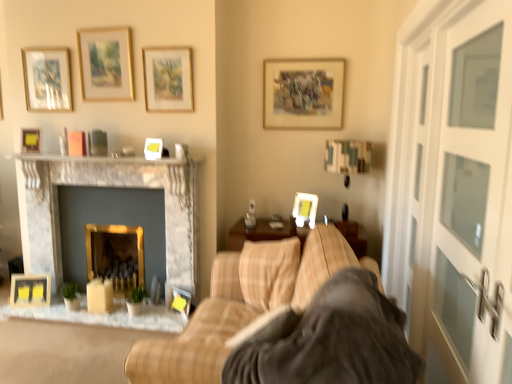
I want to click on vacant space in front of wooden picture frame at center, which is the fifth picture frame from left to right, so click(x=158, y=308).